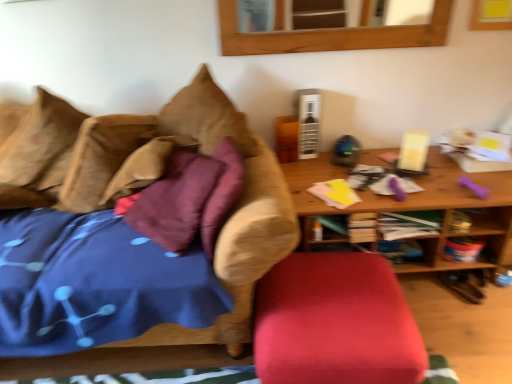
Question: From the image's perspective, is brown fabric couch at left on top of wooden table at right?

Choices:
 (A) no
 (B) yes

Answer: (A)

Question: Would you say brown fabric couch at left contains wooden table at right?

Choices:
 (A) no
 (B) yes

Answer: (A)

Question: From a real-world perspective, is brown fabric couch at left located beneath wooden table at right?

Choices:
 (A) no
 (B) yes

Answer: (A)

Question: Does brown fabric couch at left have a lesser height compared to wooden table at right?

Choices:
 (A) no
 (B) yes

Answer: (A)

Question: Are brown fabric couch at left and wooden table at right located far from each other?

Choices:
 (A) no
 (B) yes

Answer: (A)

Question: Does point (82, 208) appear closer or farther from the camera than point (134, 281)?

Choices:
 (A) farther
 (B) closer

Answer: (A)

Question: Looking at their shapes, would you say brown suede pillow at upper left, which is counted as the 2th pillow, starting from the left, is wider or thinner than brown fabric couch at left?

Choices:
 (A) wide
 (B) thin

Answer: (B)

Question: Would you say brown suede pillow at upper left, which is counted as the 2th pillow, starting from the left, is inside or outside brown fabric couch at left?

Choices:
 (A) inside
 (B) outside

Answer: (A)

Question: Is brown suede pillow at upper left, marked as the 1th pillow in a right-to-left arrangement, bigger or smaller than brown fabric couch at left?

Choices:
 (A) small
 (B) big

Answer: (A)

Question: From the image's perspective, is velvet red ottoman at lower center located above or below brown suede pillow at upper left, which is counted as the 2th pillow, starting from the left?

Choices:
 (A) above
 (B) below

Answer: (B)

Question: Based on their sizes in the image, would you say velvet red ottoman at lower center is bigger or smaller than brown suede pillow at upper left, marked as the 1th pillow in a right-to-left arrangement?

Choices:
 (A) small
 (B) big

Answer: (B)

Question: From their relative heights in the image, would you say velvet red ottoman at lower center is taller or shorter than brown suede pillow at upper left, which is counted as the 2th pillow, starting from the left?

Choices:
 (A) short
 (B) tall

Answer: (A)

Question: Does point (342, 364) appear closer or farther from the camera than point (153, 129)?

Choices:
 (A) closer
 (B) farther

Answer: (A)

Question: Choose the correct answer: Is velvet red ottoman at lower center inside wooden mirror at upper center or outside it?

Choices:
 (A) outside
 (B) inside

Answer: (A)

Question: From a real-world perspective, relative to wooden mirror at upper center, is velvet red ottoman at lower center vertically above or below?

Choices:
 (A) above
 (B) below

Answer: (B)